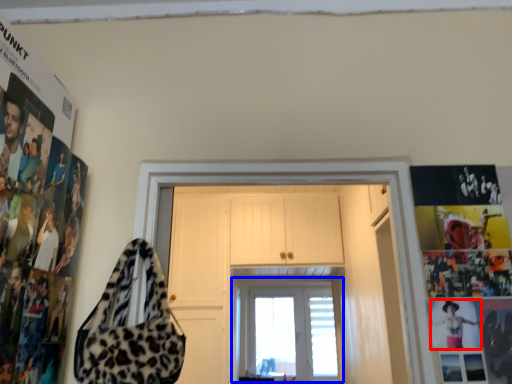
Question: Among these objects, which one is farthest to the camera, person (highlighted by a red box) or window (highlighted by a blue box)?

Choices:
 (A) person
 (B) window

Answer: (B)